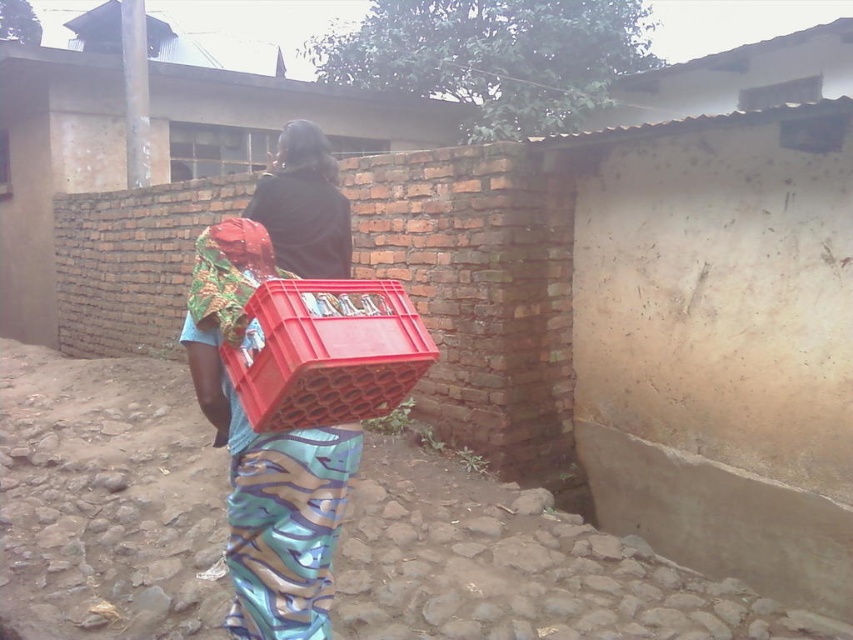
Can you confirm if matte plastic crate at center is taller than red plastic crate at center?

Indeed, matte plastic crate at center has a greater height compared to red plastic crate at center.

Who is positioned more to the left, matte plastic crate at center or red plastic crate at center?

Positioned to the left is matte plastic crate at center.

This screenshot has width=853, height=640. What do you see at coordinates (276, 506) in the screenshot?
I see `matte plastic crate at center` at bounding box center [276, 506].

This screenshot has height=640, width=853. What are the coordinates of `matte plastic crate at center` in the screenshot? It's located at click(276, 506).

Which is above, matte plastic crate at center or dark brown hair at center?

Positioned higher is dark brown hair at center.

Find the location of `matte plastic crate at center`. matte plastic crate at center is located at coordinates (276, 506).

Is point (218, 348) behind point (283, 156)?

That is False.

Find the location of a particular element. The width and height of the screenshot is (853, 640). matte plastic crate at center is located at coordinates (276, 506).

Who is shorter, red plastic crate at center or dark brown hair at center?

With less height is red plastic crate at center.

Where is `red plastic crate at center`? red plastic crate at center is located at coordinates (325, 353).